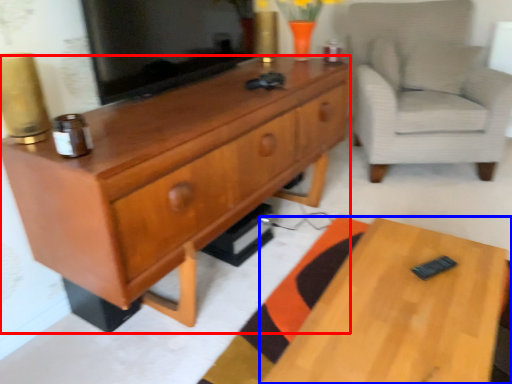
Question: Which object appears closest to the camera in this image, cabinetry (highlighted by a red box) or desk (highlighted by a blue box)?

Choices:
 (A) cabinetry
 (B) desk

Answer: (B)